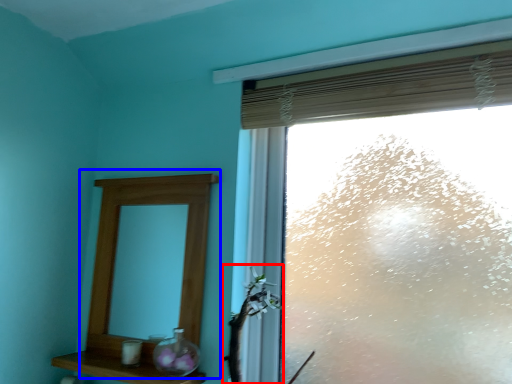
Question: Which point is further to the camera, plant (highlighted by a red box) or medicine cabinet (highlighted by a blue box)?

Choices:
 (A) plant
 (B) medicine cabinet

Answer: (B)